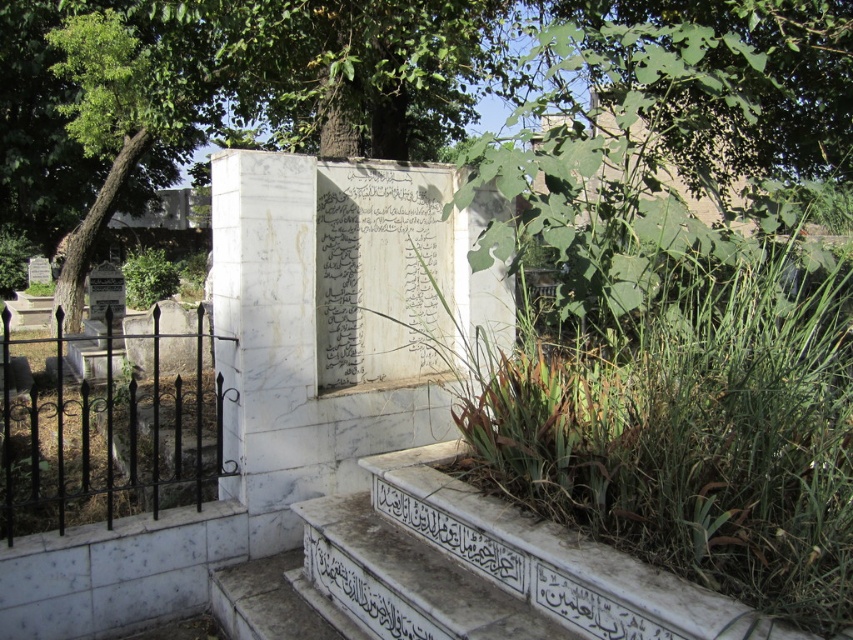
How distant is black wrought iron fence at left from black stone inscription at lower center?

A distance of 1.19 meters exists between black wrought iron fence at left and black stone inscription at lower center.

The width and height of the screenshot is (853, 640). What do you see at coordinates (109, 440) in the screenshot?
I see `black wrought iron fence at left` at bounding box center [109, 440].

Does point (53, 404) come farther from viewer compared to point (363, 577)?

That is True.

Locate an element on the screen. The width and height of the screenshot is (853, 640). black wrought iron fence at left is located at coordinates 109,440.

Who is more forward, (149,93) or (338,588)?

Point (338,588) is more forward.

Is point (181, 106) positioned after point (416, 616)?

Yes.

This screenshot has height=640, width=853. Find the location of `green leafy tree at upper left`. green leafy tree at upper left is located at coordinates (125, 112).

Is black wrought iron fence at left positioned in front of green leafy tree at upper left?

Yes, black wrought iron fence at left is in front of green leafy tree at upper left.

What do you see at coordinates (109, 440) in the screenshot? I see `black wrought iron fence at left` at bounding box center [109, 440].

Is point (28, 342) positioned in front of point (103, 147)?

Yes, point (28, 342) is in front of point (103, 147).

At what (x,y) coordinates should I click in order to perform the action: click on black wrought iron fence at left. Please return your answer as a coordinate pair (x, y). Looking at the image, I should click on (109, 440).